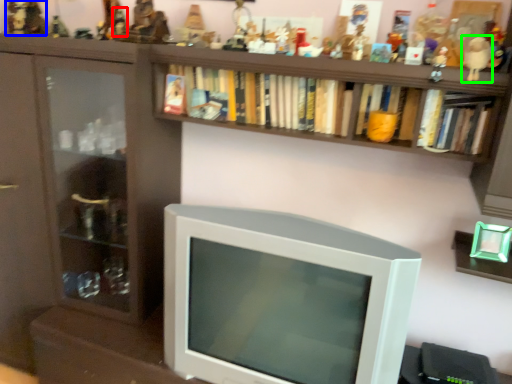
Question: Estimate the real-world distances between objects in this image. Which object is closer to toy (highlighted by a red box), toy (highlighted by a blue box) or toy (highlighted by a green box)?

Choices:
 (A) toy
 (B) toy

Answer: (A)